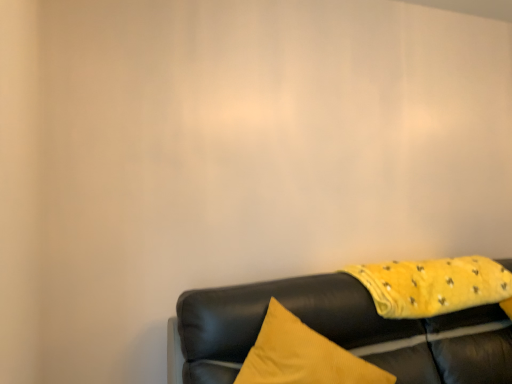
Question: Is the depth of yellow soft fabric blanket at lower right less than that of leather couch at lower right?

Choices:
 (A) no
 (B) yes

Answer: (A)

Question: Is yellow soft fabric blanket at lower right beside leather couch at lower right?

Choices:
 (A) yes
 (B) no

Answer: (B)

Question: From a real-world perspective, is yellow soft fabric blanket at lower right over leather couch at lower right?

Choices:
 (A) no
 (B) yes

Answer: (B)

Question: From the image's perspective, is yellow soft fabric blanket at lower right above leather couch at lower right?

Choices:
 (A) yes
 (B) no

Answer: (A)

Question: Is yellow soft fabric blanket at lower right not inside leather couch at lower right?

Choices:
 (A) no
 (B) yes

Answer: (A)

Question: From the image's perspective, is yellow soft fabric blanket at lower right beneath leather couch at lower right?

Choices:
 (A) yes
 (B) no

Answer: (B)

Question: Can we say leather couch at lower right lies outside yellow soft fabric blanket at lower right?

Choices:
 (A) yes
 (B) no

Answer: (A)

Question: Does leather couch at lower right have a larger size compared to yellow soft fabric blanket at lower right?

Choices:
 (A) yes
 (B) no

Answer: (A)

Question: Is leather couch at lower right wider than yellow soft fabric blanket at lower right?

Choices:
 (A) yes
 (B) no

Answer: (A)

Question: From the image's perspective, is leather couch at lower right located above yellow soft fabric blanket at lower right?

Choices:
 (A) no
 (B) yes

Answer: (A)

Question: From the image's perspective, does leather couch at lower right appear lower than yellow soft fabric blanket at lower right?

Choices:
 (A) no
 (B) yes

Answer: (B)

Question: Is leather couch at lower right further to camera compared to yellow soft fabric blanket at lower right?

Choices:
 (A) yes
 (B) no

Answer: (B)

Question: Which is correct: yellow soft fabric blanket at lower right is inside leather couch at lower right, or outside of it?

Choices:
 (A) inside
 (B) outside

Answer: (A)